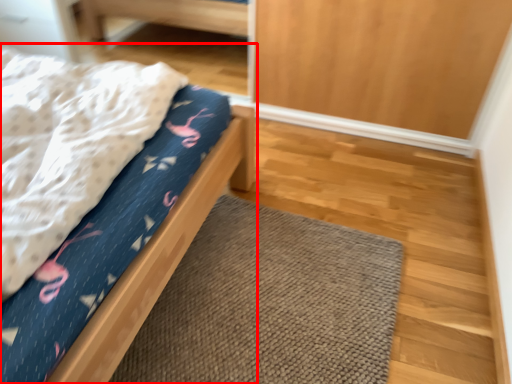
Question: From the image's perspective, where is bed (annotated by the red box) located relative to doormat?

Choices:
 (A) above
 (B) below

Answer: (A)